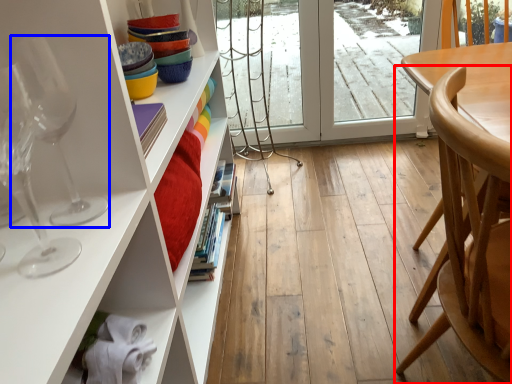
Question: Among these objects, which one is farthest to the camera, chair (highlighted by a red box) or wine glass (highlighted by a blue box)?

Choices:
 (A) chair
 (B) wine glass

Answer: (B)